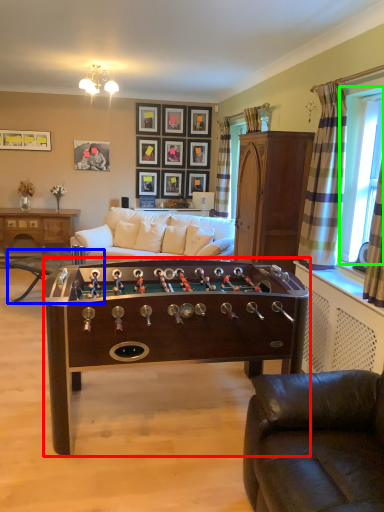
Question: Which object is positioned closest to table (highlighted by a red box)? Select from table (highlighted by a blue box) and window screen (highlighted by a green box).

Choices:
 (A) table
 (B) window screen

Answer: (B)